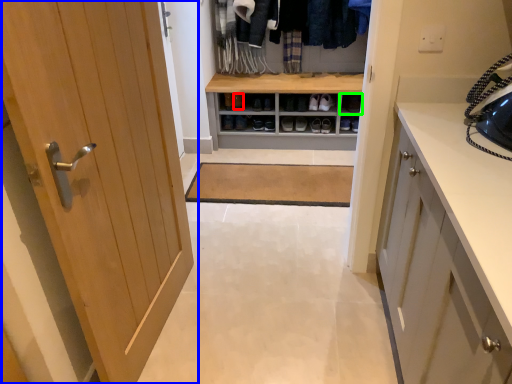
Question: Which object is the farthest from shoe (highlighted by a red box)? Choose among these: door (highlighted by a blue box) or shelf (highlighted by a green box).

Choices:
 (A) door
 (B) shelf

Answer: (A)